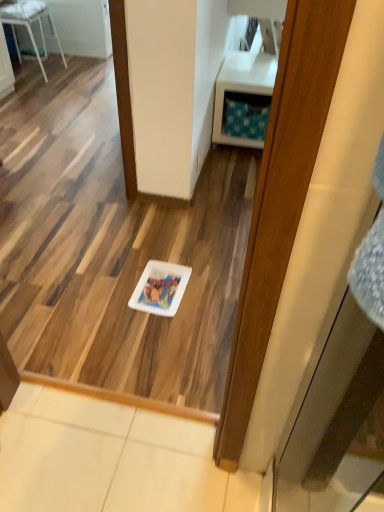
Question: Is white glossy chair at upper left a part of white glossy plate at center?

Choices:
 (A) no
 (B) yes

Answer: (A)

Question: From the image's perspective, would you say white glossy plate at center is positioned over white glossy chair at upper left?

Choices:
 (A) no
 (B) yes

Answer: (A)

Question: Is white glossy plate at center bigger than white glossy chair at upper left?

Choices:
 (A) yes
 (B) no

Answer: (B)

Question: Is white glossy plate at center thinner than white glossy chair at upper left?

Choices:
 (A) yes
 (B) no

Answer: (A)

Question: From a real-world perspective, is white glossy plate at center located higher than white glossy chair at upper left?

Choices:
 (A) yes
 (B) no

Answer: (B)

Question: Based on their sizes in the image, would you say white glossy plate at center is bigger or smaller than white plastic vanity at upper right?

Choices:
 (A) small
 (B) big

Answer: (A)

Question: From the image's perspective, is white glossy plate at center positioned above or below white plastic vanity at upper right?

Choices:
 (A) above
 (B) below

Answer: (B)

Question: Considering the positions of white glossy plate at center and white plastic vanity at upper right in the image, is white glossy plate at center wider or thinner than white plastic vanity at upper right?

Choices:
 (A) wide
 (B) thin

Answer: (B)

Question: Considering the relative positions of white glossy plate at center and white plastic vanity at upper right in the image provided, is white glossy plate at center to the left or to the right of white plastic vanity at upper right?

Choices:
 (A) left
 (B) right

Answer: (A)

Question: Is point click(54, 30) closer or farther from the camera than point click(147, 283)?

Choices:
 (A) closer
 (B) farther

Answer: (B)

Question: Based on their sizes in the image, would you say white glossy chair at upper left is bigger or smaller than white glossy plate at center?

Choices:
 (A) big
 (B) small

Answer: (A)

Question: From a real-world perspective, is white glossy chair at upper left physically located above or below white glossy plate at center?

Choices:
 (A) above
 (B) below

Answer: (A)

Question: From the image's perspective, is white glossy chair at upper left above or below white glossy plate at center?

Choices:
 (A) above
 (B) below

Answer: (A)

Question: From their relative heights in the image, would you say white glossy plate at center is taller or shorter than white glossy chair at upper left?

Choices:
 (A) tall
 (B) short

Answer: (B)

Question: Is white glossy plate at center to the left or to the right of white glossy chair at upper left in the image?

Choices:
 (A) left
 (B) right

Answer: (B)